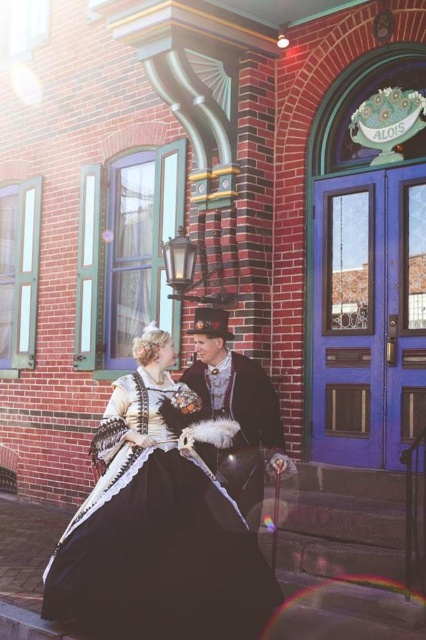
You are a costume designer observing the scene. You need to determine which garment requires more fabric to create between the black satin dress at center and the velvet black coat at center. Which one would need more fabric?

The black satin dress at center is larger in size than the velvet black coat at center, so it would require more fabric to create.

You are a tailor observing two garments in the image. The black satin dress at center and the velvet black coat at center. Which garment is taller?

The black satin dress at center is much taller than the velvet black coat at center.